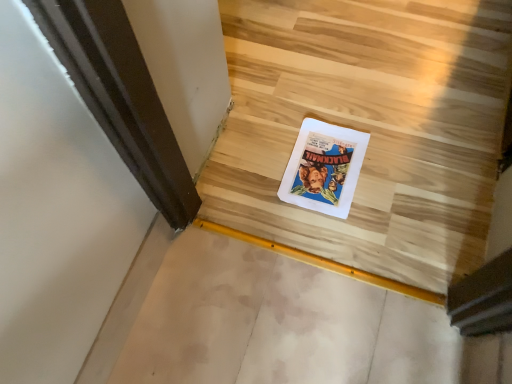
Identify the location of empty space that is ontop of matte white book cover at center (from a real-world perspective). (321, 161).